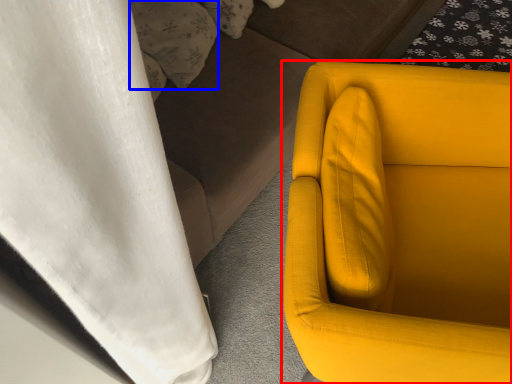
Question: Among these objects, which one is nearest to the camera, chair (highlighted by a red box) or pillow (highlighted by a blue box)?

Choices:
 (A) chair
 (B) pillow

Answer: (A)